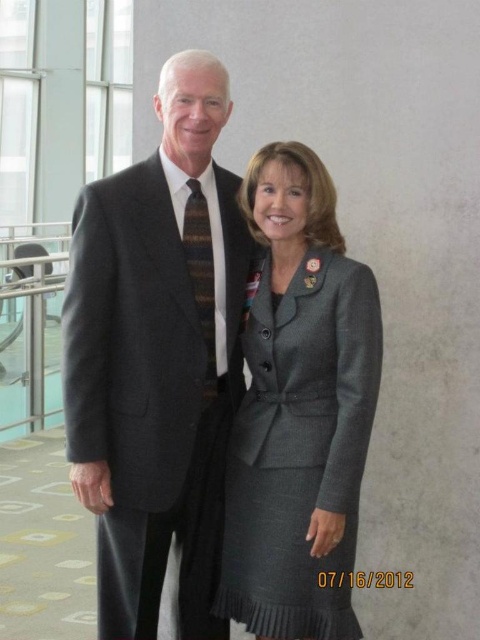
Question: Can you confirm if dark gray suit at center is bigger than gray wool suit at center?

Choices:
 (A) no
 (B) yes

Answer: (B)

Question: Which point is farther to the camera?

Choices:
 (A) dark gray suit at center
 (B) gray wool suit at center

Answer: (A)

Question: Is dark gray suit at center thinner than gray wool suit at center?

Choices:
 (A) yes
 (B) no

Answer: (B)

Question: Is dark gray suit at center further to the viewer compared to gray wool suit at center?

Choices:
 (A) no
 (B) yes

Answer: (B)